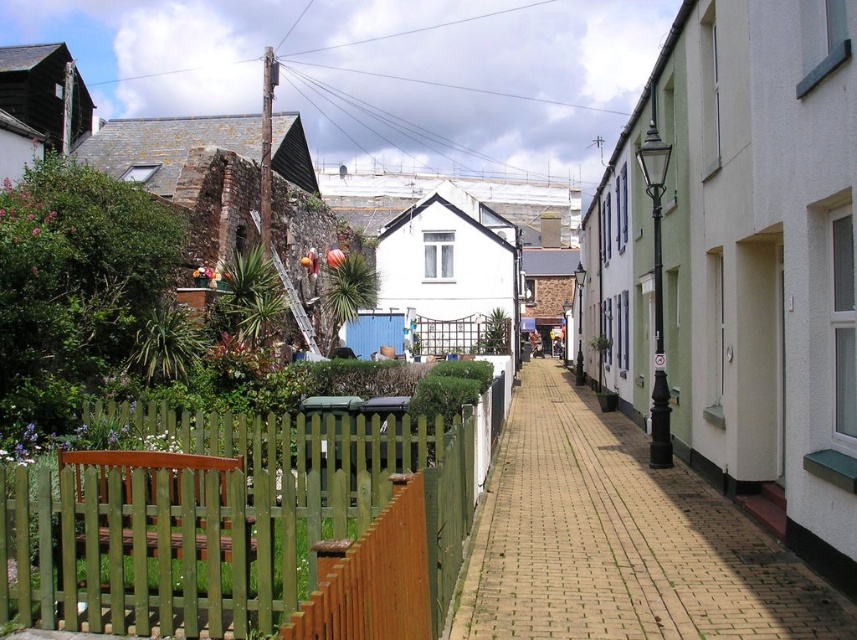
Question: Considering the relative positions of green wooden fence at lower left and brick paved walkway at center in the image provided, where is green wooden fence at lower left located with respect to brick paved walkway at center?

Choices:
 (A) above
 (B) below

Answer: (A)

Question: Which object is closer to the camera taking this photo?

Choices:
 (A) green wooden fence at lower left
 (B) brick paved walkway at center

Answer: (A)

Question: In this image, where is green wooden fence at lower left located relative to brick paved walkway at center?

Choices:
 (A) below
 (B) above

Answer: (B)

Question: Which object is farther from the camera taking this photo?

Choices:
 (A) brick paved walkway at center
 (B) green wooden fence at lower left

Answer: (A)

Question: Can you confirm if green wooden fence at lower left is positioned to the left of brick paved walkway at center?

Choices:
 (A) no
 (B) yes

Answer: (B)